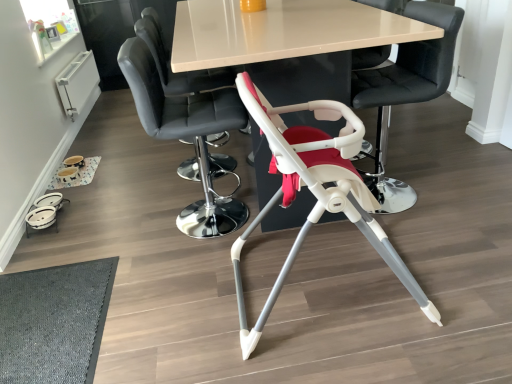
This screenshot has height=384, width=512. In order to click on unoccupied region to the right of white plastic highchair at center, marked as the first chair in a right-to-left arrangement in this screenshot , I will do `click(453, 180)`.